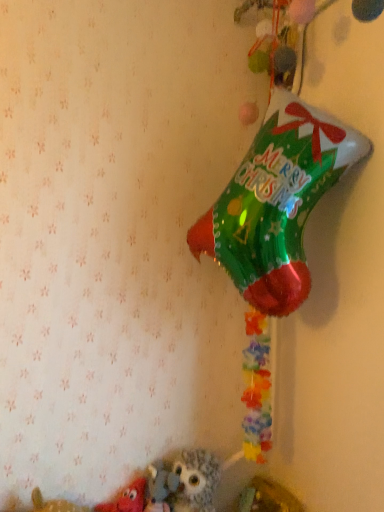
Locate an element on the screen. Image resolution: width=384 pixels, height=512 pixels. matte red plush toy at lower left, acting as the 2th toy starting from the right is located at coordinates (127, 498).

The height and width of the screenshot is (512, 384). Describe the element at coordinates (127, 498) in the screenshot. I see `matte red plush toy at lower left, the first toy viewed from the left` at that location.

What is the approximate width of fluffy gray owl at lower center, which appears as the 1th toy when viewed from the right?

It is 6.17 inches.

What do you see at coordinates (195, 480) in the screenshot? I see `fluffy gray owl at lower center, which appears as the 1th toy when viewed from the right` at bounding box center [195, 480].

Identify the location of fluffy gray owl at lower center, which appears as the 1th toy when viewed from the right. (195, 480).

You are a GUI agent. You are given a task and a screenshot of the screen. Output one action in this format:
    pyautogui.click(x=<x>, y=<y>)
    Task: Click on the matte red plush toy at lower left, the first toy viewed from the left
    
    Given the screenshot: What is the action you would take?
    pyautogui.click(x=127, y=498)

Which is more to the right, matte red plush toy at lower left, acting as the 2th toy starting from the right, or fluffy gray owl at lower center, which appears as the 1th toy when viewed from the right?

fluffy gray owl at lower center, which appears as the 1th toy when viewed from the right.

Which object is closer to the camera taking this photo, matte red plush toy at lower left, acting as the 2th toy starting from the right, or fluffy gray owl at lower center, which appears as the 1th toy when viewed from the right?

matte red plush toy at lower left, acting as the 2th toy starting from the right.

Is point (121, 499) positioned in front of point (211, 498)?

Yes, it is in front of point (211, 498).

From the image's perspective, would you say matte red plush toy at lower left, acting as the 2th toy starting from the right, is shown under fluffy gray owl at lower center, which appears as the 1th toy when viewed from the right?

Correct, matte red plush toy at lower left, acting as the 2th toy starting from the right, appears lower than fluffy gray owl at lower center, which appears as the 1th toy when viewed from the right, in the image.

From a real-world perspective, is matte red plush toy at lower left, the first toy viewed from the left, on fluffy gray owl at lower center, which appears as the 1th toy when viewed from the right?

Incorrect, from a real-world perspective, matte red plush toy at lower left, the first toy viewed from the left, is lower than fluffy gray owl at lower center, which appears as the 1th toy when viewed from the right.

Can you confirm if matte red plush toy at lower left, the first toy viewed from the left, is wider than fluffy gray owl at lower center, which appears as the 1th toy when viewed from the right?

In fact, matte red plush toy at lower left, the first toy viewed from the left, might be narrower than fluffy gray owl at lower center, which appears as the 1th toy when viewed from the right.

Does matte red plush toy at lower left, acting as the 2th toy starting from the right, have a lesser height compared to fluffy gray owl at lower center, which appears as the 1th toy when viewed from the right?

Yes, matte red plush toy at lower left, acting as the 2th toy starting from the right, is shorter than fluffy gray owl at lower center, which appears as the 1th toy when viewed from the right.

Can you confirm if matte red plush toy at lower left, the first toy viewed from the left, is smaller than fluffy gray owl at lower center, which appears as the 1th toy when viewed from the right?

→ Yes.

Is matte red plush toy at lower left, the first toy viewed from the left, situated inside fluffy gray owl at lower center, the second toy in the left-to-right sequence, or outside?

matte red plush toy at lower left, the first toy viewed from the left, is located beyond the bounds of fluffy gray owl at lower center, the second toy in the left-to-right sequence.

Consider the image. Is matte red plush toy at lower left, the first toy viewed from the left, positioned with its back to fluffy gray owl at lower center, which appears as the 1th toy when viewed from the right?

matte red plush toy at lower left, the first toy viewed from the left, is not turned away from fluffy gray owl at lower center, which appears as the 1th toy when viewed from the right.

In the scene shown: How far apart are matte red plush toy at lower left, acting as the 2th toy starting from the right, and fluffy gray owl at lower center, the second toy in the left-to-right sequence?

matte red plush toy at lower left, acting as the 2th toy starting from the right, is 5.52 inches from fluffy gray owl at lower center, the second toy in the left-to-right sequence.

The width and height of the screenshot is (384, 512). Find the location of `toy that appears above the matte red plush toy at lower left, acting as the 2th toy starting from the right (from the image's perspective)`. toy that appears above the matte red plush toy at lower left, acting as the 2th toy starting from the right (from the image's perspective) is located at coordinates (195, 480).

In the scene shown: Does fluffy gray owl at lower center, the second toy in the left-to-right sequence, appear on the right side of matte red plush toy at lower left, acting as the 2th toy starting from the right?

Yes.

Considering their positions, is fluffy gray owl at lower center, the second toy in the left-to-right sequence, located in front of or behind matte red plush toy at lower left, acting as the 2th toy starting from the right?

fluffy gray owl at lower center, the second toy in the left-to-right sequence, is positioned farther from the viewer than matte red plush toy at lower left, acting as the 2th toy starting from the right.

Which is in front, point (207, 490) or point (134, 483)?

The point (207, 490) is closer to the camera.

In the scene shown: From the image's perspective, is fluffy gray owl at lower center, which appears as the 1th toy when viewed from the right, on top of matte red plush toy at lower left, the first toy viewed from the left?

Yes, from the image's perspective, fluffy gray owl at lower center, which appears as the 1th toy when viewed from the right, is over matte red plush toy at lower left, the first toy viewed from the left.

From a real-world perspective, between fluffy gray owl at lower center, the second toy in the left-to-right sequence, and matte red plush toy at lower left, the first toy viewed from the left, who is vertically higher?

fluffy gray owl at lower center, the second toy in the left-to-right sequence, is physically above.

Is fluffy gray owl at lower center, the second toy in the left-to-right sequence, wider or thinner than matte red plush toy at lower left, acting as the 2th toy starting from the right?

Clearly, fluffy gray owl at lower center, the second toy in the left-to-right sequence, has more width compared to matte red plush toy at lower left, acting as the 2th toy starting from the right.

Who is taller, fluffy gray owl at lower center, which appears as the 1th toy when viewed from the right, or matte red plush toy at lower left, acting as the 2th toy starting from the right?

Standing taller between the two is fluffy gray owl at lower center, which appears as the 1th toy when viewed from the right.

In terms of size, does fluffy gray owl at lower center, the second toy in the left-to-right sequence, appear bigger or smaller than matte red plush toy at lower left, the first toy viewed from the left?

Considering their sizes, fluffy gray owl at lower center, the second toy in the left-to-right sequence, takes up more space than matte red plush toy at lower left, the first toy viewed from the left.

Is matte red plush toy at lower left, the first toy viewed from the left, a part of fluffy gray owl at lower center, which appears as the 1th toy when viewed from the right?

That's incorrect, matte red plush toy at lower left, the first toy viewed from the left, is not inside fluffy gray owl at lower center, which appears as the 1th toy when viewed from the right.

Would you consider fluffy gray owl at lower center, which appears as the 1th toy when viewed from the right, to be distant from matte red plush toy at lower left, acting as the 2th toy starting from the right?

No, fluffy gray owl at lower center, which appears as the 1th toy when viewed from the right, is not far from matte red plush toy at lower left, acting as the 2th toy starting from the right.

Is fluffy gray owl at lower center, the second toy in the left-to-right sequence, oriented towards matte red plush toy at lower left, acting as the 2th toy starting from the right?

No, fluffy gray owl at lower center, the second toy in the left-to-right sequence, is not facing towards matte red plush toy at lower left, acting as the 2th toy starting from the right.

How many degrees apart are the facing directions of fluffy gray owl at lower center, which appears as the 1th toy when viewed from the right, and matte red plush toy at lower left, the first toy viewed from the left?

The angular difference between fluffy gray owl at lower center, which appears as the 1th toy when viewed from the right, and matte red plush toy at lower left, the first toy viewed from the left, is 0.00235 degrees.

Locate an element on the screen. toy that appears below the fluffy gray owl at lower center, which appears as the 1th toy when viewed from the right (from a real-world perspective) is located at coordinates point(127,498).

Find the location of a particular element. toy beneath the fluffy gray owl at lower center, the second toy in the left-to-right sequence (from a real-world perspective) is located at coordinates (127, 498).

Image resolution: width=384 pixels, height=512 pixels. I want to click on toy above the matte red plush toy at lower left, the first toy viewed from the left (from the image's perspective), so click(195, 480).